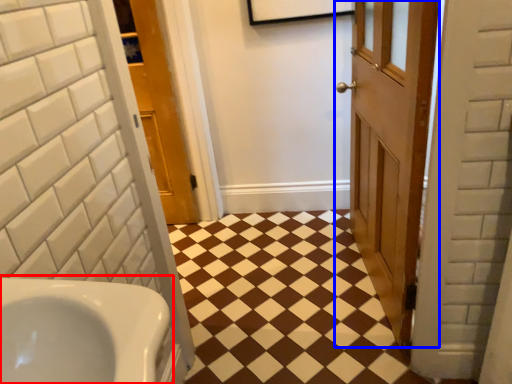
Question: Among these objects, which one is nearest to the camera, sink (highlighted by a red box) or door (highlighted by a blue box)?

Choices:
 (A) sink
 (B) door

Answer: (A)